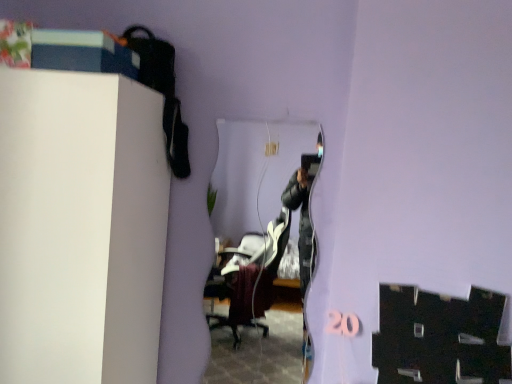
Question: From the image's perspective, is clear glass mirror at center positioned above or below white matte cabinet at upper left?

Choices:
 (A) below
 (B) above

Answer: (A)

Question: From a real-world perspective, relative to white matte cabinet at upper left, is clear glass mirror at center vertically above or below?

Choices:
 (A) above
 (B) below

Answer: (A)

Question: Which is correct: clear glass mirror at center is inside white matte cabinet at upper left, or outside of it?

Choices:
 (A) outside
 (B) inside

Answer: (A)

Question: Is point (99, 178) closer or farther from the camera than point (287, 367)?

Choices:
 (A) farther
 (B) closer

Answer: (B)

Question: From a real-world perspective, is white matte cabinet at upper left physically located above or below clear glass mirror at center?

Choices:
 (A) below
 (B) above

Answer: (A)

Question: Considering the relative positions of white matte cabinet at upper left and clear glass mirror at center in the image provided, is white matte cabinet at upper left to the left or to the right of clear glass mirror at center?

Choices:
 (A) left
 (B) right

Answer: (A)

Question: In the image, is white matte cabinet at upper left positioned in front of or behind clear glass mirror at center?

Choices:
 (A) front
 (B) behind

Answer: (A)